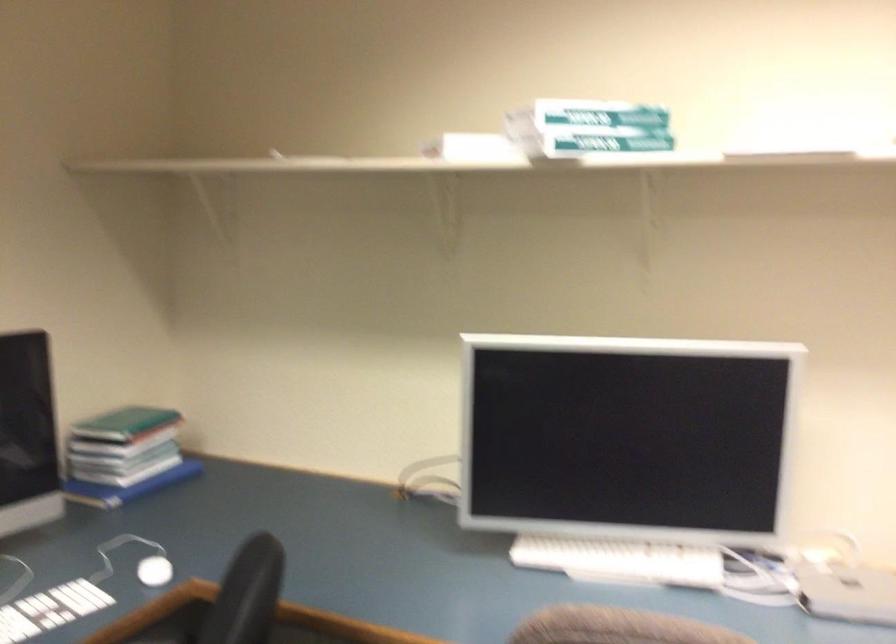
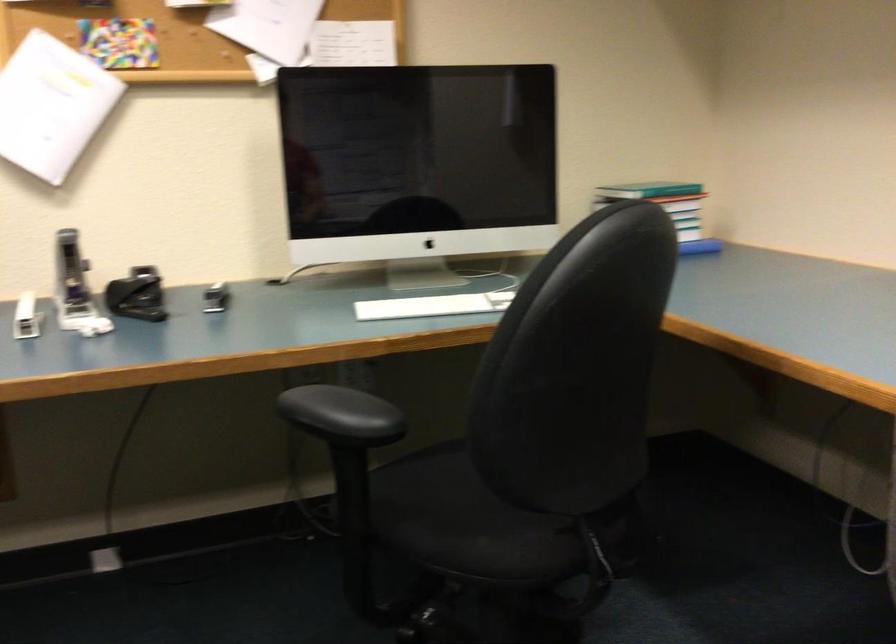
Question: Based on the continuous images, in which direction is the camera rotating? Reply with the corresponding letter.

Choices:
 (A) Left
 (B) Right
 (C) Up
 (D) Down

Answer: (A)